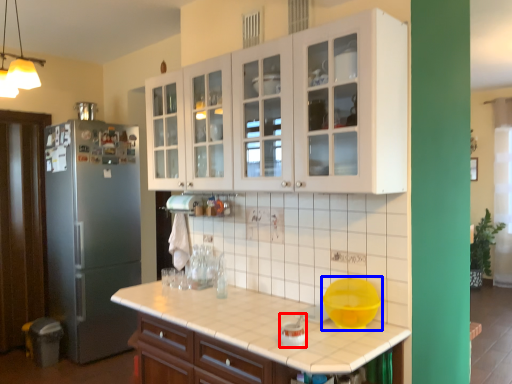
Question: Among these objects, which one is nearest to the camera, appliance (highlighted by a red box) or mixing bowl (highlighted by a blue box)?

Choices:
 (A) appliance
 (B) mixing bowl

Answer: (A)